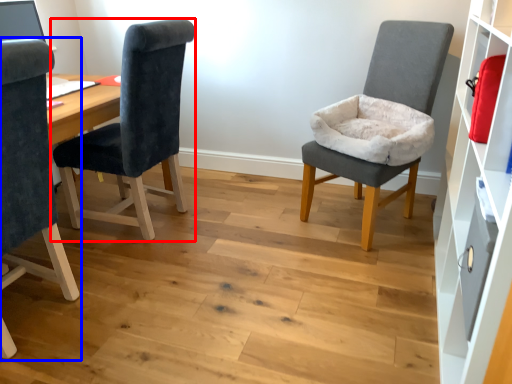
Question: Which object is further to the camera taking this photo, chair (highlighted by a red box) or chair (highlighted by a blue box)?

Choices:
 (A) chair
 (B) chair

Answer: (A)